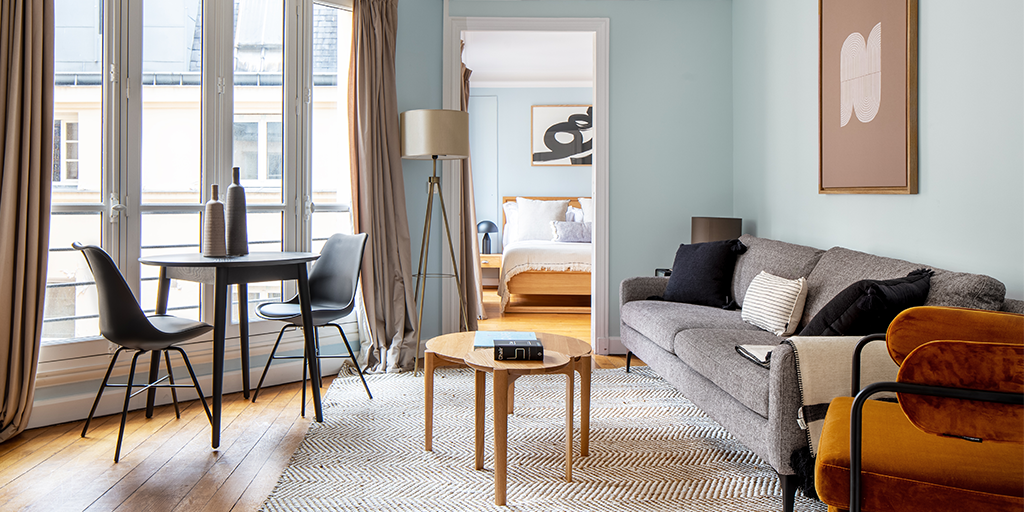
This screenshot has width=1024, height=512. I want to click on door frame, so click(603, 139).